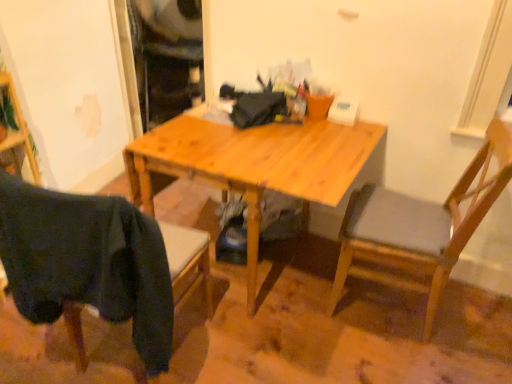
Question: From the image's perspective, is wooden chair at right, the first chair in the right-to-left sequence, on top of dark fabric chair at lower left, which ranks as the 2th chair in right-to-left order?

Choices:
 (A) yes
 (B) no

Answer: (A)

Question: Is the depth of wooden chair at right, the 2th chair in the left-to-right sequence, greater than that of dark fabric chair at lower left, which is the 1th chair in left-to-right order?

Choices:
 (A) no
 (B) yes

Answer: (B)

Question: Would you say wooden chair at right, the 2th chair in the left-to-right sequence, contains dark fabric chair at lower left, which is the 1th chair in left-to-right order?

Choices:
 (A) no
 (B) yes

Answer: (A)

Question: Is wooden chair at right, the first chair in the right-to-left sequence, with dark fabric chair at lower left, which is the 1th chair in left-to-right order?

Choices:
 (A) no
 (B) yes

Answer: (A)

Question: Is wooden chair at right, the first chair in the right-to-left sequence, positioned beyond the bounds of dark fabric chair at lower left, which is the 1th chair in left-to-right order?

Choices:
 (A) no
 (B) yes

Answer: (B)

Question: Considering their positions, is wooden chair at right, the first chair in the right-to-left sequence, located in front of or behind dark fabric chair at lower left, which is the 1th chair in left-to-right order?

Choices:
 (A) behind
 (B) front

Answer: (A)

Question: In terms of width, does wooden chair at right, the first chair in the right-to-left sequence, look wider or thinner when compared to dark fabric chair at lower left, which is the 1th chair in left-to-right order?

Choices:
 (A) thin
 (B) wide

Answer: (B)

Question: From the image's perspective, is wooden chair at right, the first chair in the right-to-left sequence, located above or below dark fabric chair at lower left, which ranks as the 2th chair in right-to-left order?

Choices:
 (A) below
 (B) above

Answer: (B)

Question: Based on their sizes in the image, would you say wooden chair at right, the first chair in the right-to-left sequence, is bigger or smaller than dark fabric chair at lower left, which is the 1th chair in left-to-right order?

Choices:
 (A) big
 (B) small

Answer: (A)

Question: From a real-world perspective, relative to light wood desk at center, is dark fabric chair at lower left, which ranks as the 2th chair in right-to-left order, vertically above or below?

Choices:
 (A) below
 (B) above

Answer: (B)

Question: In the image, is dark fabric chair at lower left, which ranks as the 2th chair in right-to-left order, on the left side or the right side of light wood desk at center?

Choices:
 (A) right
 (B) left

Answer: (B)

Question: Considering the positions of dark fabric chair at lower left, which is the 1th chair in left-to-right order, and light wood desk at center in the image, is dark fabric chair at lower left, which is the 1th chair in left-to-right order, bigger or smaller than light wood desk at center?

Choices:
 (A) big
 (B) small

Answer: (B)

Question: Relative to light wood desk at center, is dark fabric chair at lower left, which is the 1th chair in left-to-right order, in front or behind?

Choices:
 (A) behind
 (B) front

Answer: (B)

Question: From the image's perspective, relative to wooden chair at right, the first chair in the right-to-left sequence, is dark fabric chair at lower left, which ranks as the 2th chair in right-to-left order, above or below?

Choices:
 (A) below
 (B) above

Answer: (A)

Question: From a real-world perspective, relative to wooden chair at right, the first chair in the right-to-left sequence, is dark fabric chair at lower left, which is the 1th chair in left-to-right order, vertically above or below?

Choices:
 (A) below
 (B) above

Answer: (B)